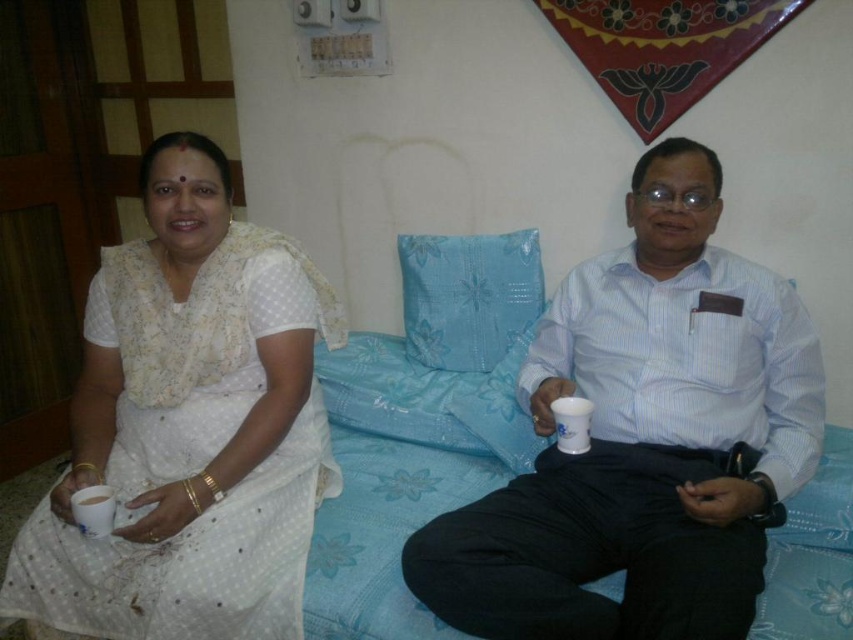
Does point (697, 422) come closer to viewer compared to point (105, 513)?

No, it is not.

Who is shorter, white glossy shirt at center or white paper cup at lower left?

Standing shorter between the two is white paper cup at lower left.

Between point (558, 509) and point (74, 515), which one is positioned behind?

The point (558, 509) is more distant.

Image resolution: width=853 pixels, height=640 pixels. Find the location of `white glossy shirt at center`. white glossy shirt at center is located at coordinates (643, 438).

Which is in front, point (584, 608) or point (469, 275)?

Point (584, 608) is in front.

Find the location of `white glossy shirt at center`. white glossy shirt at center is located at coordinates (643, 438).

Does white dotted fabric at left have a lesser height compared to white paper cup at lower left?

In fact, white dotted fabric at left may be taller than white paper cup at lower left.

Between point (300, 419) and point (112, 516), which one is positioned behind?

Point (300, 419)

The image size is (853, 640). I want to click on white dotted fabric at left, so click(189, 426).